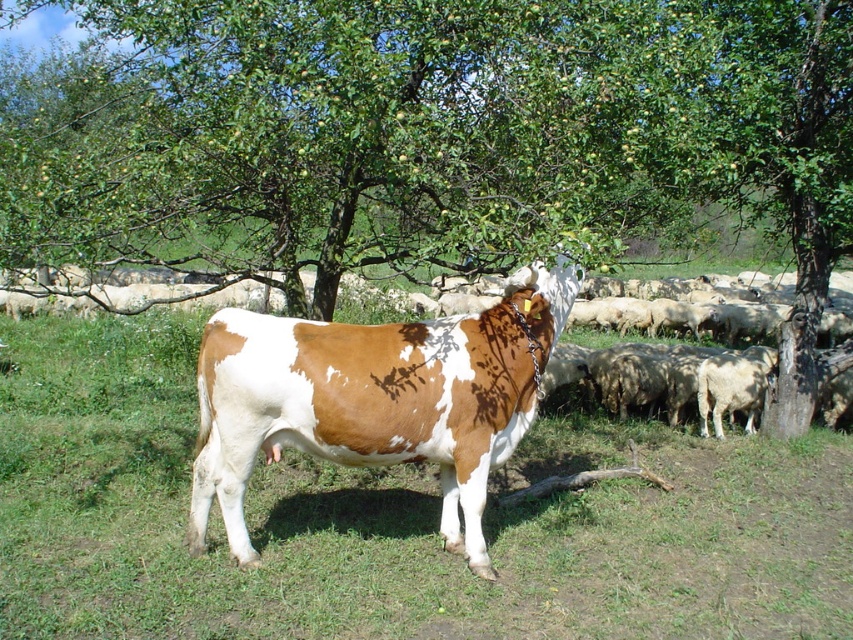
You are a farmer walking towards the green leafy tree at center and the brown and white textured cow at center. Which one will you reach first?

The brown and white textured cow at center will be reached first because it is closer to you than the green leafy tree at center, which is further away.

You are standing in the field and see the green leafy tree at center and the brown and white textured cow at center. Which object is higher from the ground?

The green leafy tree at center is higher from the ground than the brown and white textured cow at center.

You are a farmer checking the field. You notice the green leafy tree at center and the brown and white textured cow at center. Which one is taller?

The green leafy tree at center has a lesser height compared to brown and white textured cow at center, so the brown and white textured cow at center is taller.